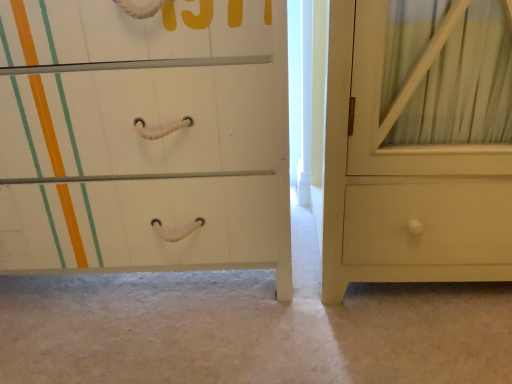
Measure the distance between point (286,52) and camera.

The distance of point (286,52) from camera is 1.04 meters.

This screenshot has width=512, height=384. Describe the element at coordinates (143, 137) in the screenshot. I see `white matte rope handle at left` at that location.

In order to click on white matte rope handle at left in this screenshot , I will do `click(143, 137)`.

Locate an element on the screen. The width and height of the screenshot is (512, 384). white matte rope handle at left is located at coordinates (143, 137).